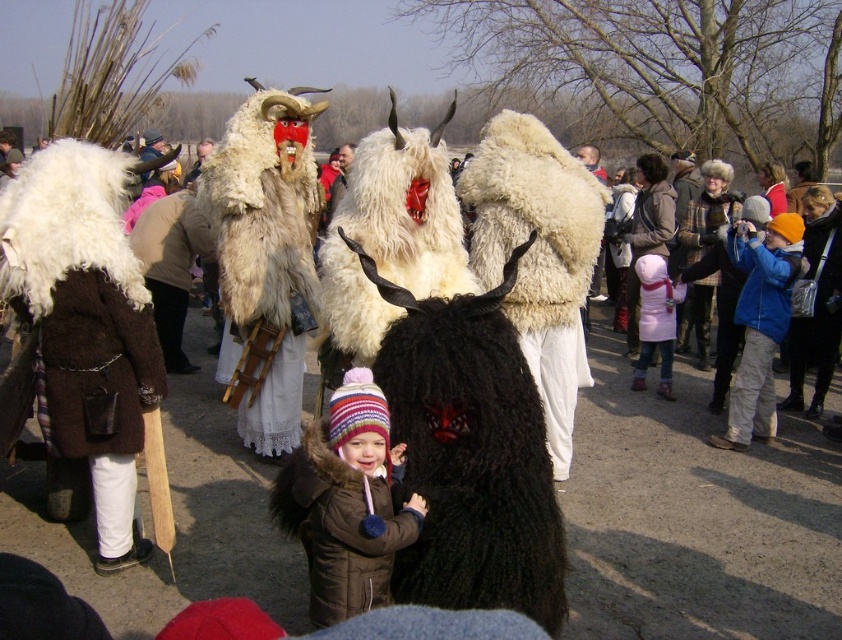
Question: Which of these objects is positioned closest to the furry white mask at center?

Choices:
 (A) brown fuzzy coat at center
 (B) furry costume at center
 (C) pink fleece coat at center

Answer: (A)

Question: Is brown fuzzy coat at center bigger than pink fleece coat at center?

Choices:
 (A) no
 (B) yes

Answer: (A)

Question: Estimate the real-world distances between objects in this image. Which object is closer to the furry white mask at center?

Choices:
 (A) black woolen mask at center
 (B) pink fleece coat at center
 (C) brown fuzzy coat at center

Answer: (C)

Question: Is pink fleece coat at center thinner than furry costume at center?

Choices:
 (A) no
 (B) yes

Answer: (A)

Question: Does pink fleece coat at center appear under furry costume at center?

Choices:
 (A) yes
 (B) no

Answer: (A)

Question: Estimate the real-world distances between objects in this image. Which object is farther from the furry costume at center?

Choices:
 (A) pink fleece coat at center
 (B) brown fuzzy coat at center
 (C) furry white mask at center
 (D) blue fleece jacket at right

Answer: (B)